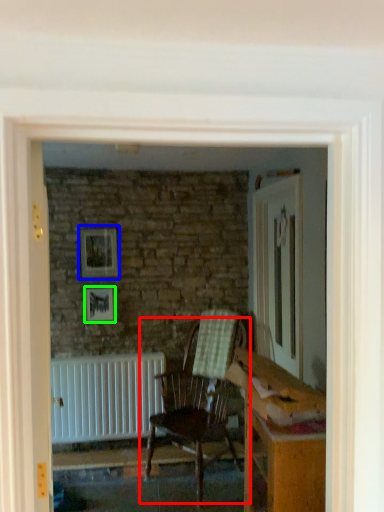
Question: Which object is positioned closest to chair (highlighted by a red box)? Select from picture frame (highlighted by a blue box) and picture frame (highlighted by a green box).

Choices:
 (A) picture frame
 (B) picture frame

Answer: (B)